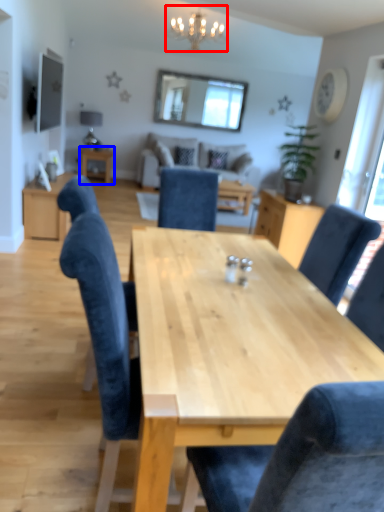
Question: Which object is closer to the camera taking this photo, light fixture (highlighted by a red box) or table (highlighted by a blue box)?

Choices:
 (A) light fixture
 (B) table

Answer: (A)